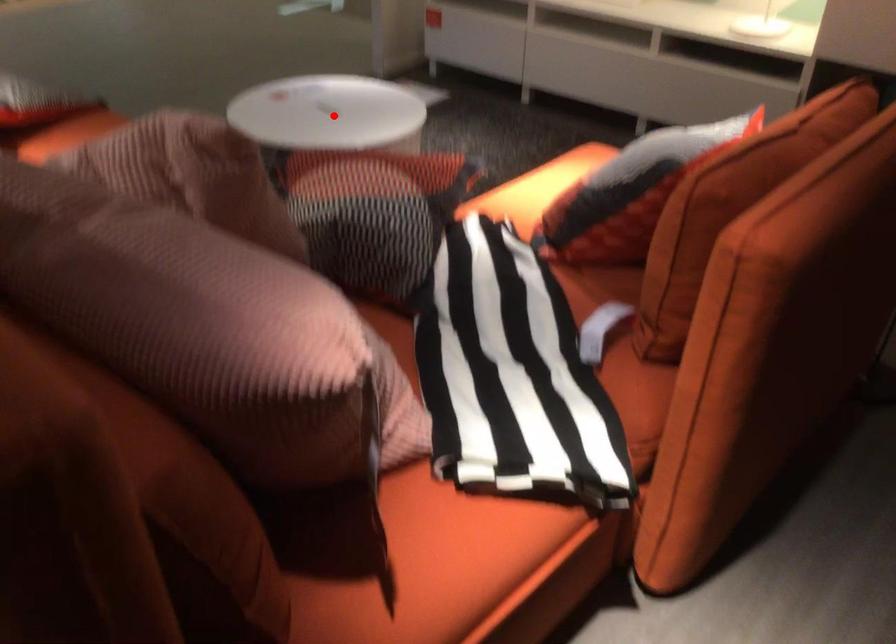
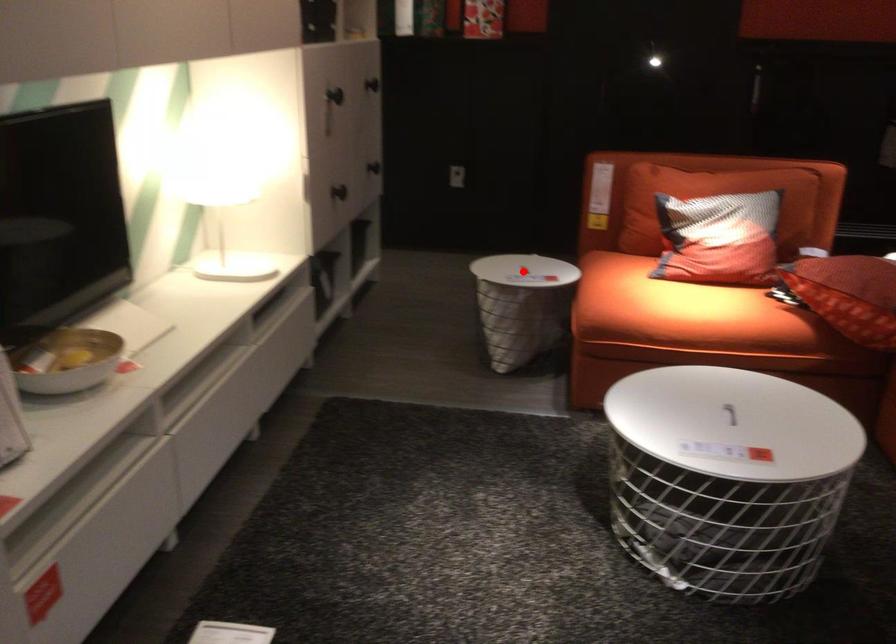
I am providing you with two images of the same scene from different viewpoints. A red point is marked on the first image and another point is marked on the second image. Do the highlighted points in image1 and image2 indicate the same real-world spot?

No